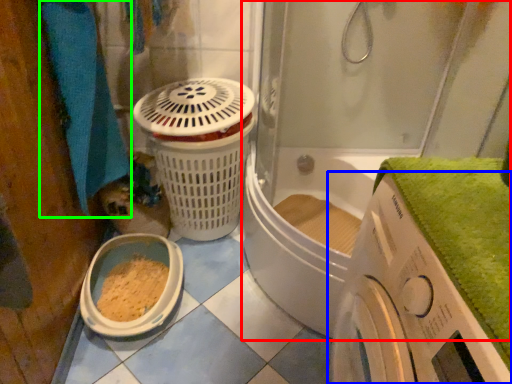
Question: Considering the real-world distances, which object is closest to shower door (highlighted by a red box)? washing machine (highlighted by a blue box) or bath towel (highlighted by a green box).

Choices:
 (A) washing machine
 (B) bath towel

Answer: (A)